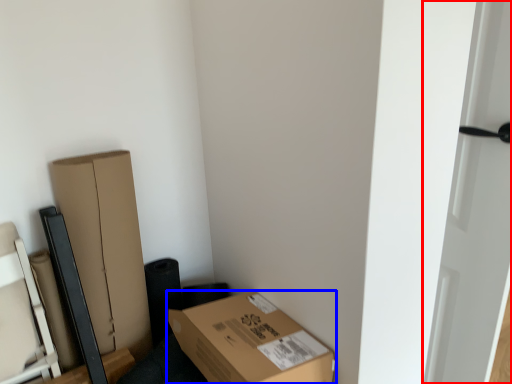
Question: Which object appears farthest to the camera in this image, door (highlighted by a red box) or box (highlighted by a blue box)?

Choices:
 (A) door
 (B) box

Answer: (B)